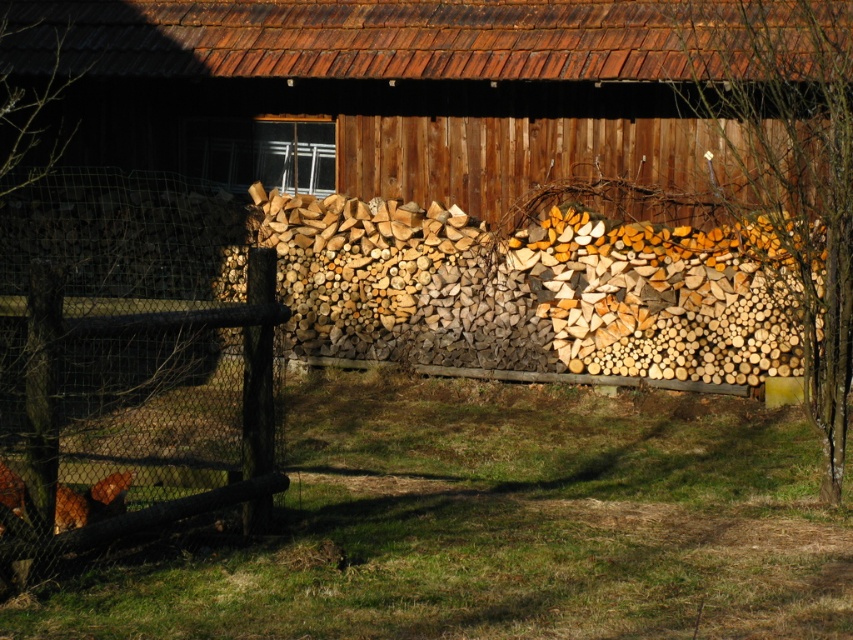
Question: Among these points, which one is farthest from the camera?

Choices:
 (A) (79, 150)
 (B) (248, 372)

Answer: (A)

Question: Is wooden at center above brown wooden fence at left?

Choices:
 (A) no
 (B) yes

Answer: (B)

Question: Considering the relative positions of wooden at center and brown wooden fence at left in the image provided, where is wooden at center located with respect to brown wooden fence at left?

Choices:
 (A) above
 (B) below

Answer: (A)

Question: Which point is closer to the camera?

Choices:
 (A) brown wooden fence at left
 (B) wooden at center

Answer: (A)

Question: Is wooden at center below brown wooden fence at left?

Choices:
 (A) yes
 (B) no

Answer: (B)